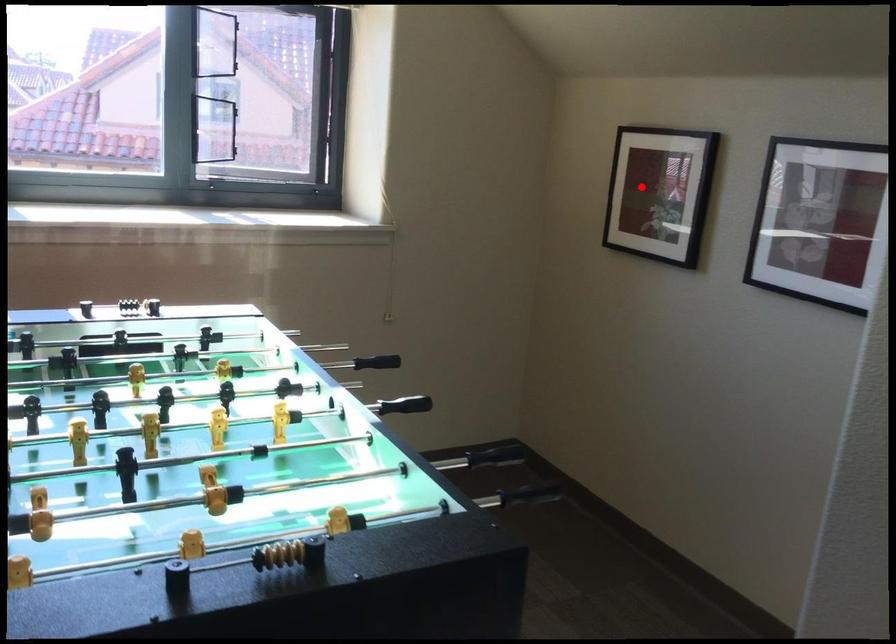
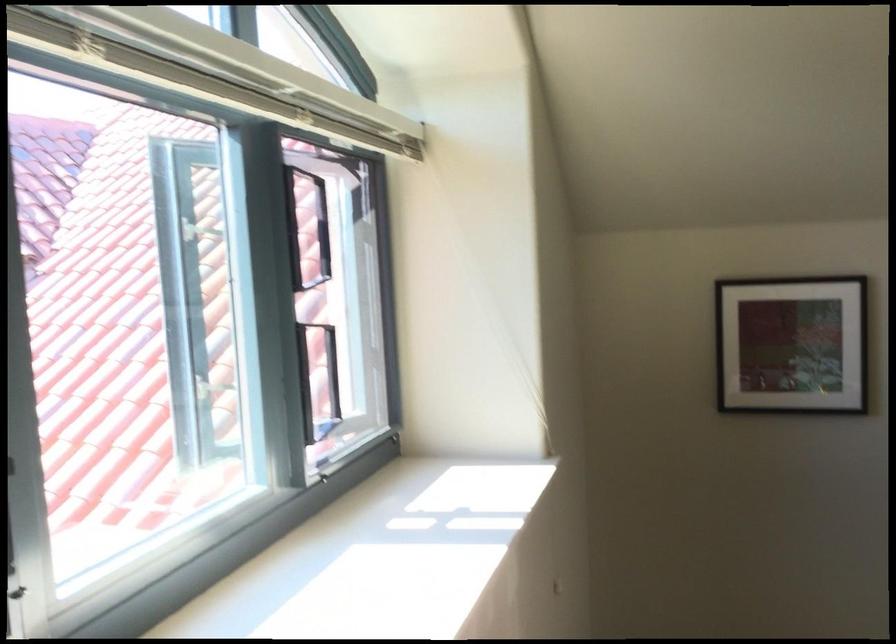
The point at the highlighted location is marked in the first image. Where is the corresponding point in the second image?

(791, 345)